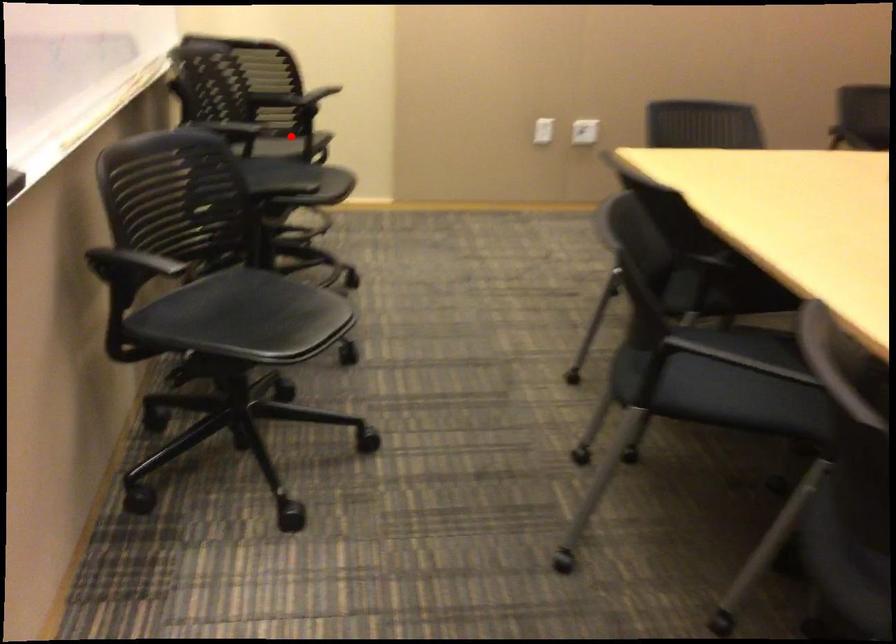
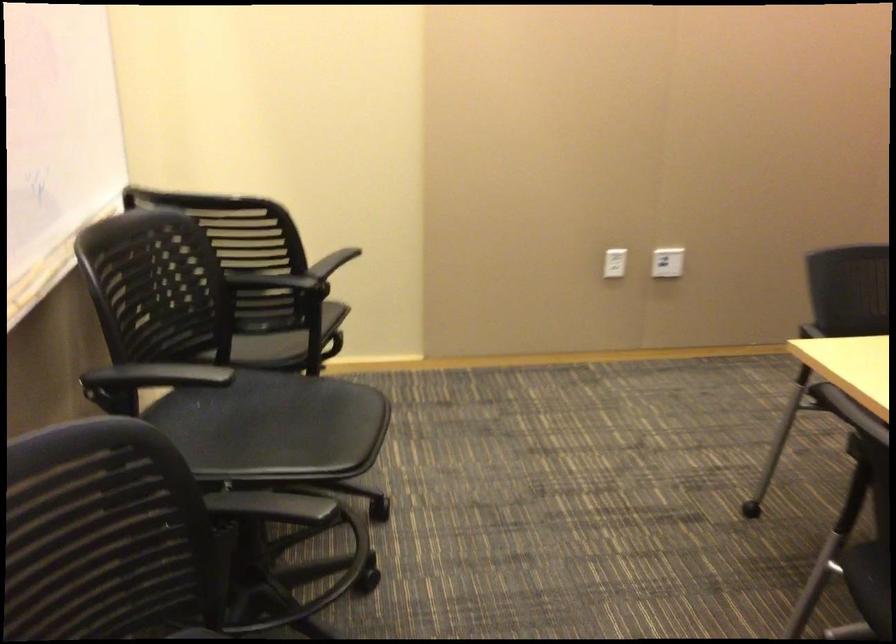
The point at the highlighted location is marked in the first image. Where is the corresponding point in the second image?

(287, 341)